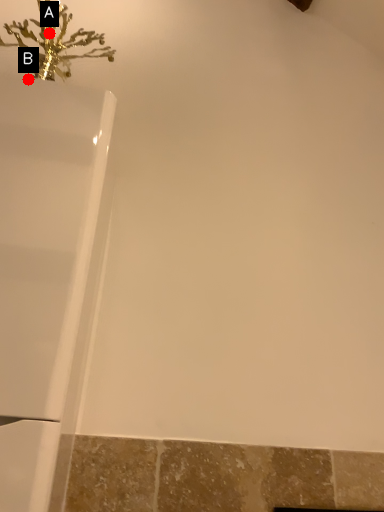
Question: Two points are circled on the image, labeled by A and B beside each circle. Which point is closer to the camera taking this photo?

Choices:
 (A) A is closer
 (B) B is closer

Answer: (B)